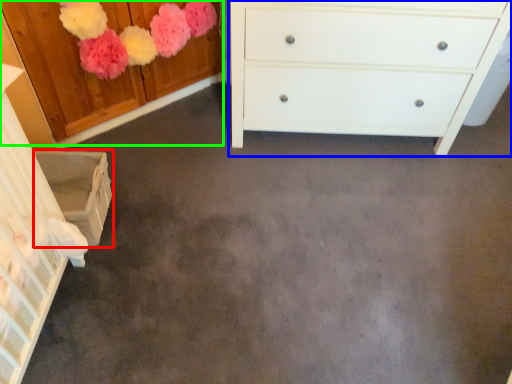
Question: Based on their relative distances, which object is nearer to cabinetry (highlighted by a red box)? Choose from chest of drawers (highlighted by a blue box) and cabinetry (highlighted by a green box).

Choices:
 (A) chest of drawers
 (B) cabinetry

Answer: (B)